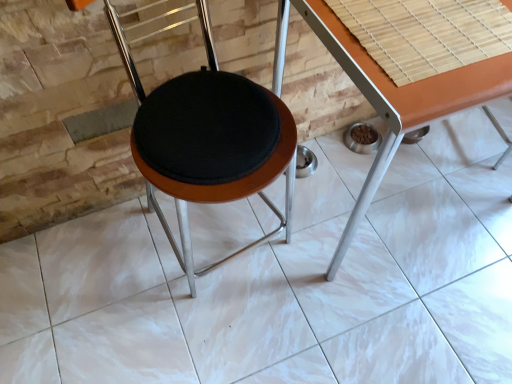
Question: In terms of height, does orange laminate table at center look taller or shorter compared to black fabric cushion at center?

Choices:
 (A) tall
 (B) short

Answer: (B)

Question: Based on their sizes in the image, would you say orange laminate table at center is bigger or smaller than black fabric cushion at center?

Choices:
 (A) small
 (B) big

Answer: (B)

Question: Which is farther from the black fabric cushion at center?

Choices:
 (A) orange laminate table at center
 (B) bamboo mat at upper right

Answer: (B)

Question: Considering the real-world distances, which object is closest to the bamboo mat at upper right?

Choices:
 (A) orange laminate table at center
 (B) black fabric cushion at center

Answer: (A)